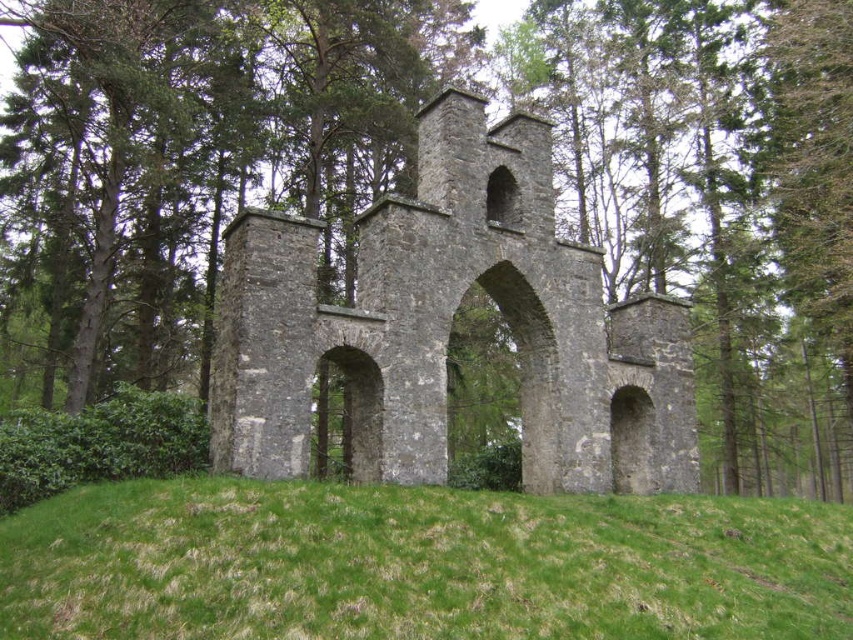
You are standing in front of the ancient stone structure. You see the green grassy hill at center and the gray stone archway at center. Which one is closer to you?

The green grassy hill at center is closer to you because it is in front of the gray stone archway at center.

You are standing in front of the ancient stone structure and want to determine the spatial relationship between two points marked in the image. Which point is closer to you, point (461, 630) or point (486, 186)?

Point (461, 630) is closer to the viewer than point (486, 186).